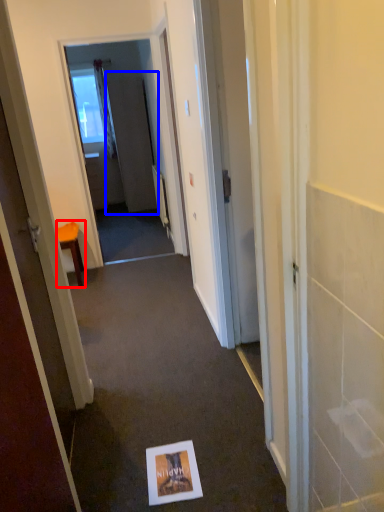
Question: Among these objects, which one is nearest to the camera, furniture (highlighted by a red box) or screen door (highlighted by a blue box)?

Choices:
 (A) furniture
 (B) screen door

Answer: (A)